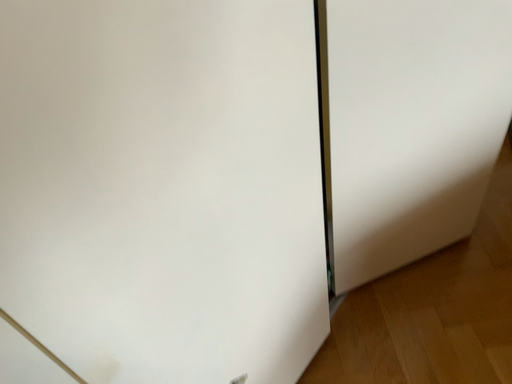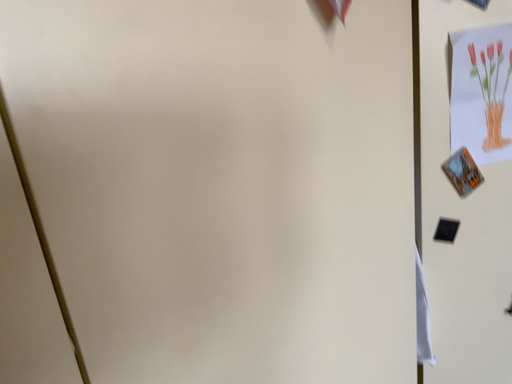
Question: How did the camera likely rotate when shooting the video?

Choices:
 (A) rotated upward
 (B) rotated downward

Answer: (A)